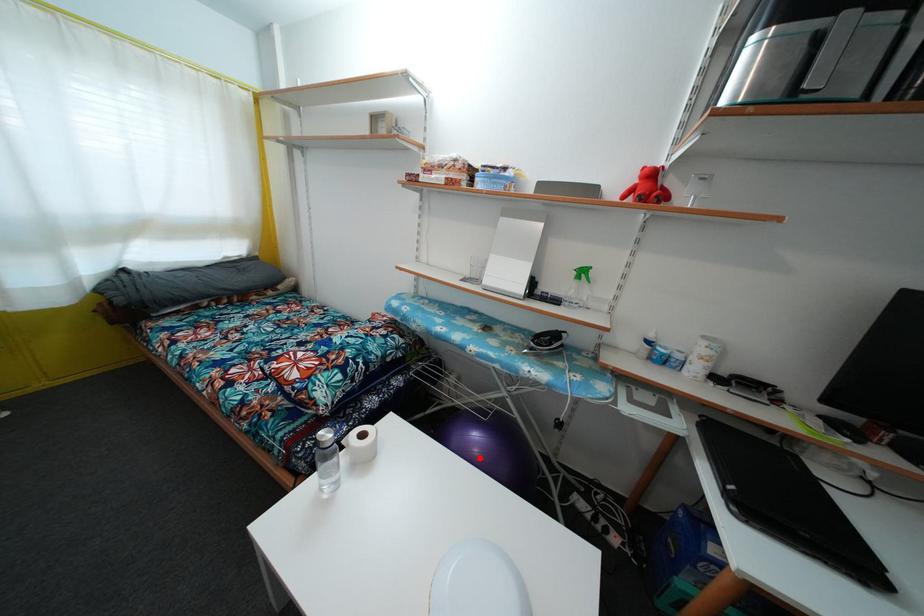
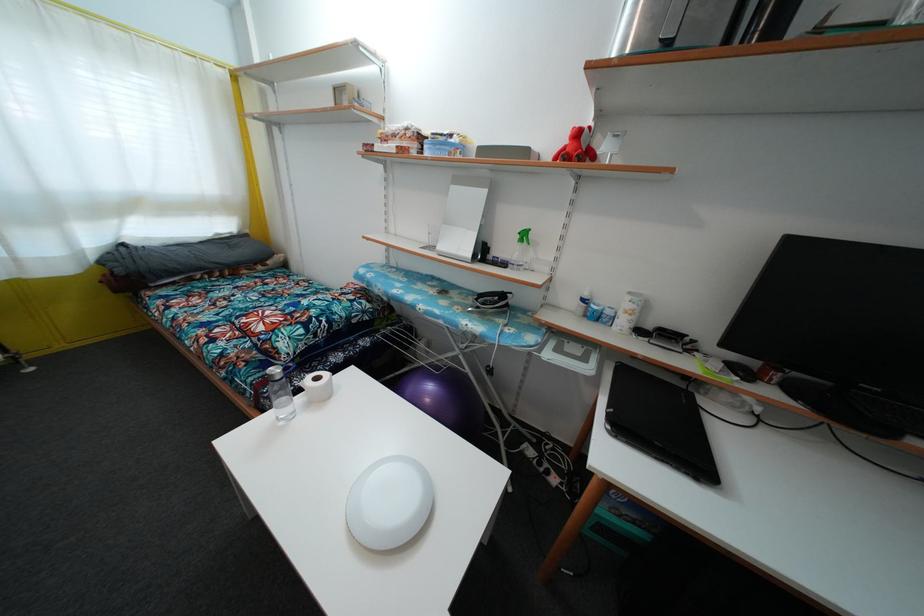
Question: I am providing you with two images of the same scene from different viewpoints. Image1 has a red point marked. In image2, the corresponding 3D location appears at what relative position? Reply with the corresponding letter.

Choices:
 (A) Closer
 (B) Farther

Answer: (A)